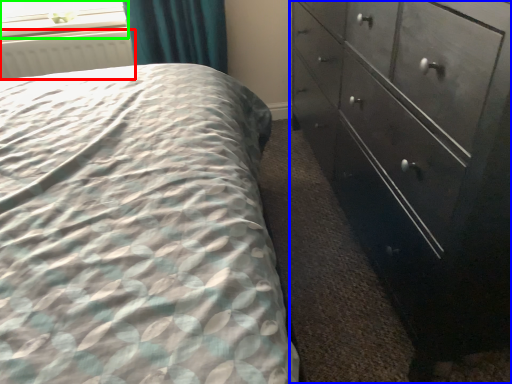
Question: Estimate the real-world distances between objects in this image. Which object is closer to radiator (highlighted by a red box), chest of drawers (highlighted by a blue box) or window screen (highlighted by a green box)?

Choices:
 (A) chest of drawers
 (B) window screen

Answer: (B)